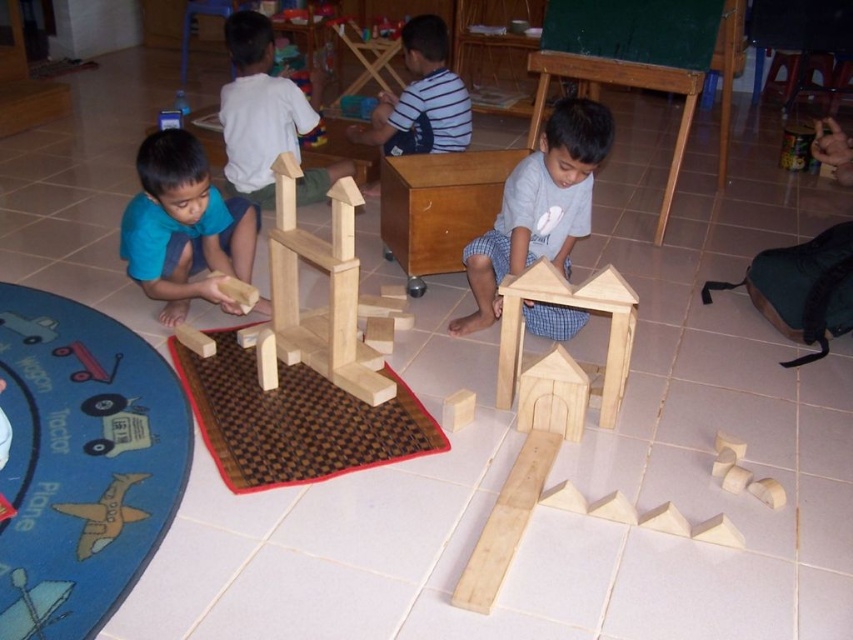
You are a teacher observing the children in the classroom. You notice the wooden house at lower center and the yellow matte airplane at lower left. Which object is closer to the left side of the room?

The yellow matte airplane at lower left is closer to the left side of the room because the wooden house at lower center is positioned to its right.

In the scene shown: You are a teacher observing the classroom. You notice the brown woven mat at center and the wooden toy car at lower left. Which object is higher in height?

The brown woven mat at center is much taller than the wooden toy car at lower left according to the description.

You are a child in the classroom and want to reach the wooden toy car at lower left without stepping on the brown woven mat at center. Is this possible?

The brown woven mat at center is in front of the wooden toy car at lower left, so you can reach the wooden toy car at lower left without stepping on the mat by moving around it.